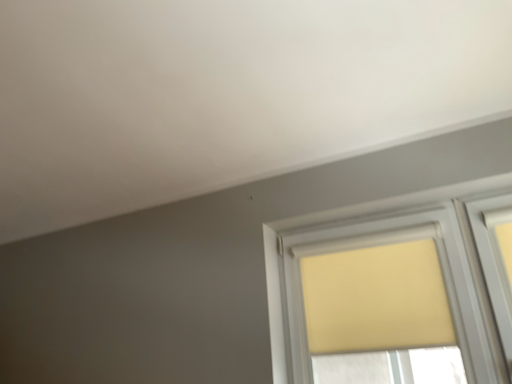
Question: Should I look upward or downward to see beige fabric curtain at upper right?

Choices:
 (A) down
 (B) up

Answer: (A)